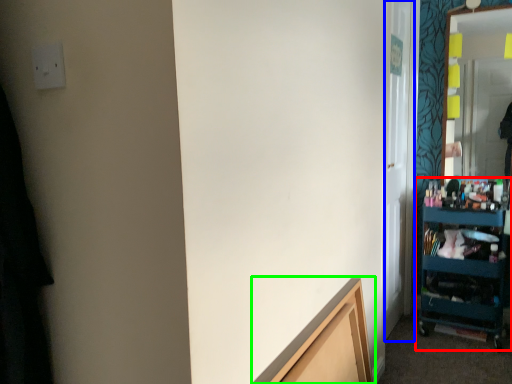
Question: Which object is the farthest from shelf (highlighted by a red box)? Choose among these: glass door (highlighted by a blue box) or cabinetry (highlighted by a green box).

Choices:
 (A) glass door
 (B) cabinetry

Answer: (B)